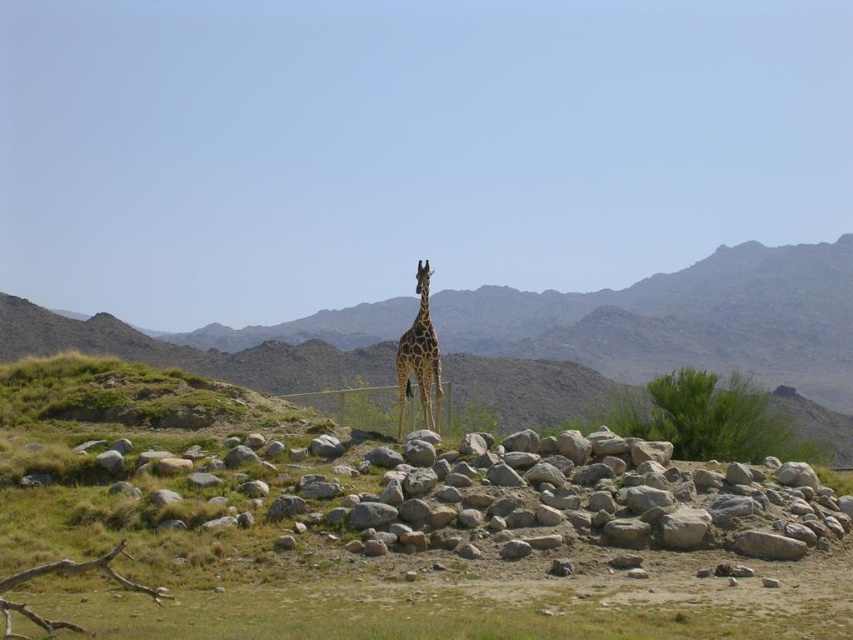
Question: Does brown rocky mountain at center lie in front of spotted fur giraffe at center?

Choices:
 (A) yes
 (B) no

Answer: (B)

Question: Which point is farther from the camera taking this photo?

Choices:
 (A) (413, 346)
 (B) (724, 259)

Answer: (B)

Question: Where is brown rocky mountain at center located in relation to spotted fur giraffe at center in the image?

Choices:
 (A) below
 (B) above

Answer: (A)

Question: Which object appears closest to the camera in this image?

Choices:
 (A) brown rocky mountain at center
 (B) spotted fur giraffe at center

Answer: (B)

Question: Considering the relative positions of brown rocky mountain at center and spotted fur giraffe at center in the image provided, where is brown rocky mountain at center located with respect to spotted fur giraffe at center?

Choices:
 (A) right
 (B) left

Answer: (B)